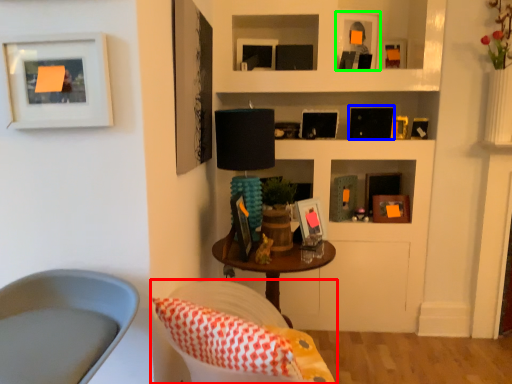
Question: Based on their relative distances, which object is farther from chair (highlighted by a red box)? Choose from picture frame (highlighted by a blue box) and picture frame (highlighted by a green box).

Choices:
 (A) picture frame
 (B) picture frame

Answer: (B)